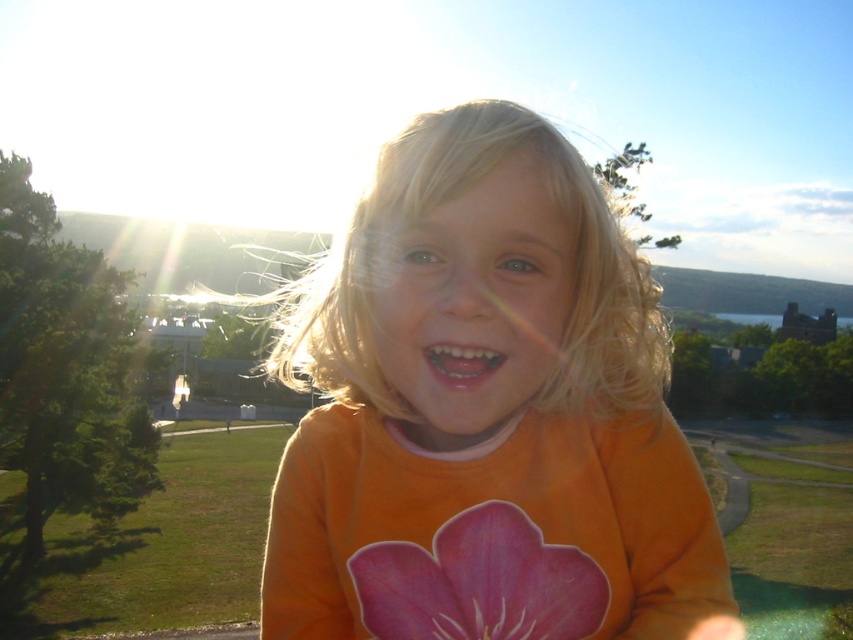
Question: Which point is closer to the camera?

Choices:
 (A) (369, 579)
 (B) (668, 362)

Answer: (A)

Question: Is orange matte shirt at center closer to camera compared to pink paper flower at center?

Choices:
 (A) no
 (B) yes

Answer: (B)

Question: Does orange matte shirt at center appear under pink paper flower at center?

Choices:
 (A) yes
 (B) no

Answer: (B)

Question: Among these points, which one is farthest from the camera?

Choices:
 (A) (555, 572)
 (B) (397, 596)

Answer: (B)

Question: Can you confirm if orange matte shirt at center is positioned to the right of pink paper flower at center?

Choices:
 (A) yes
 (B) no

Answer: (B)